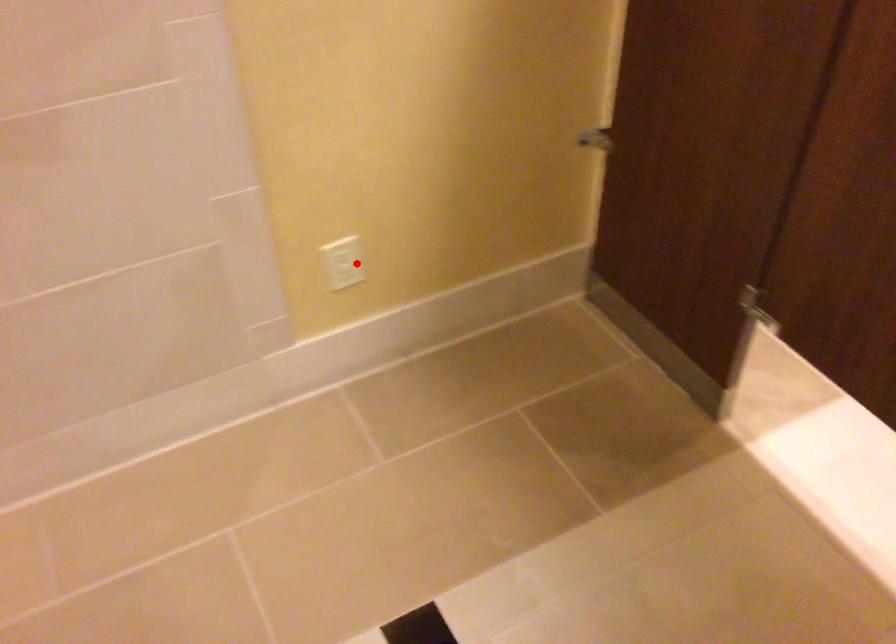
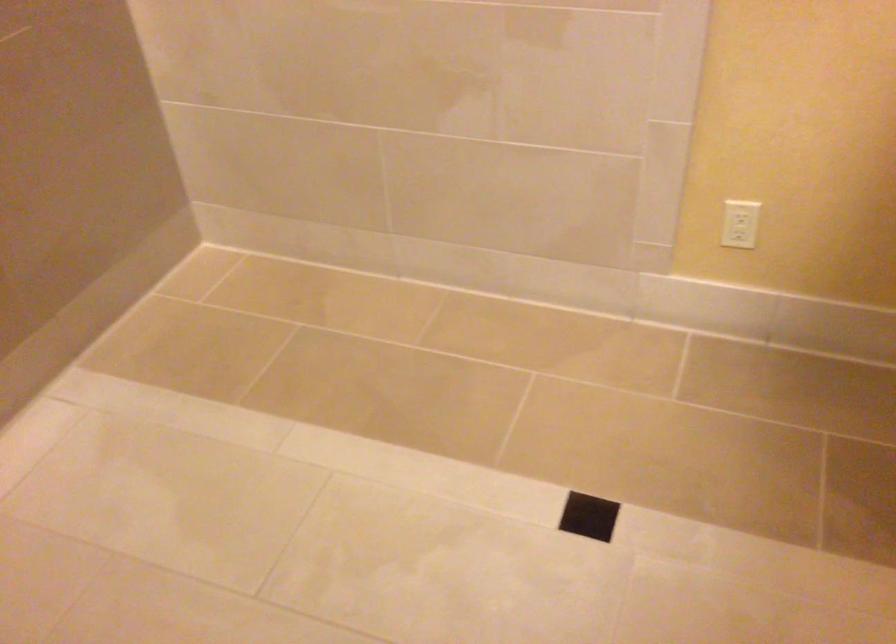
Locate, in the second image, the point that corresponds to the highlighted location in the first image.

(739, 223)